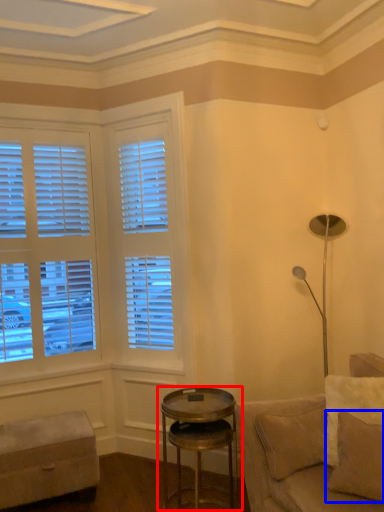
Question: Which object is further to the camera taking this photo, table (highlighted by a red box) or pillow (highlighted by a blue box)?

Choices:
 (A) table
 (B) pillow

Answer: (A)